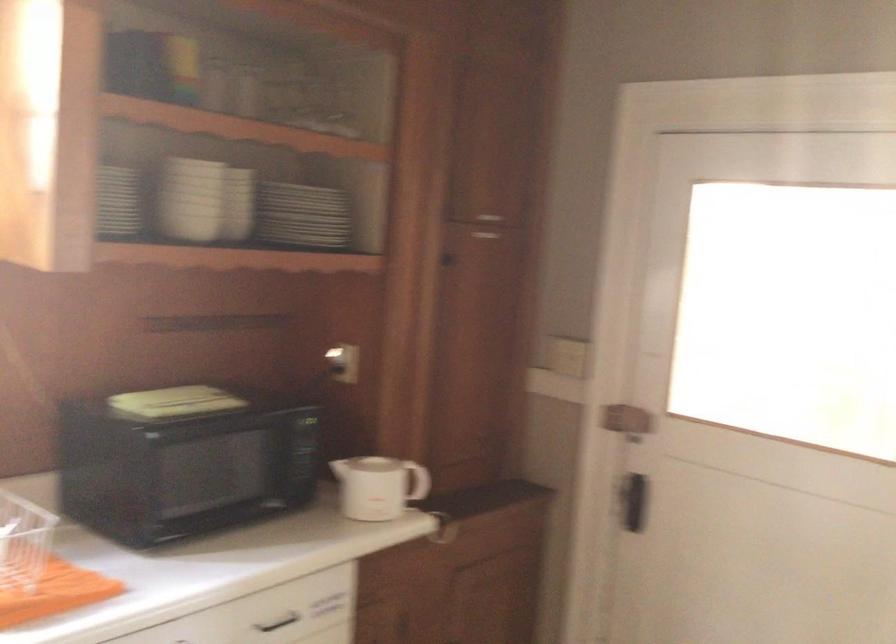
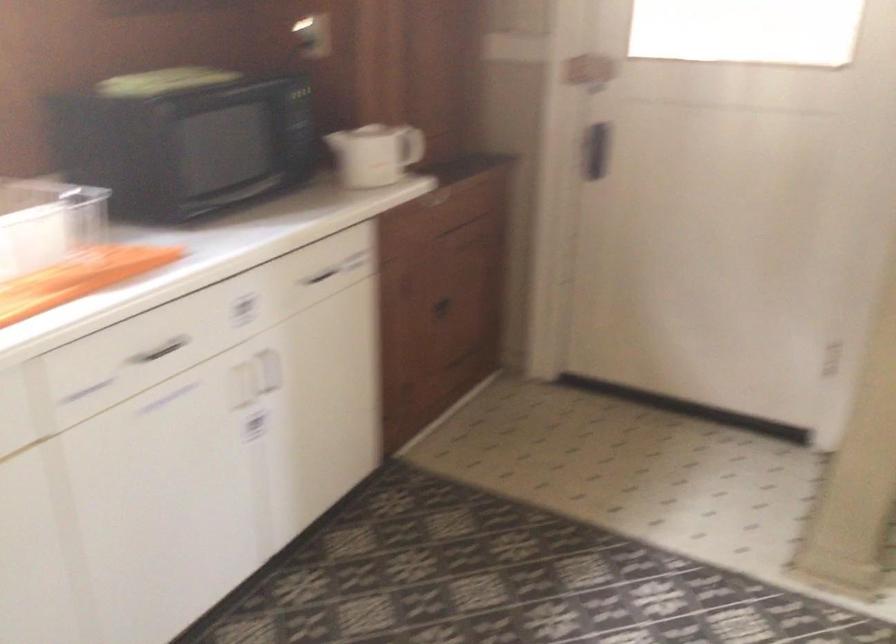
The images are taken continuously from a first-person perspective. In which direction are you moving?

The cameraman moved toward left, backward.